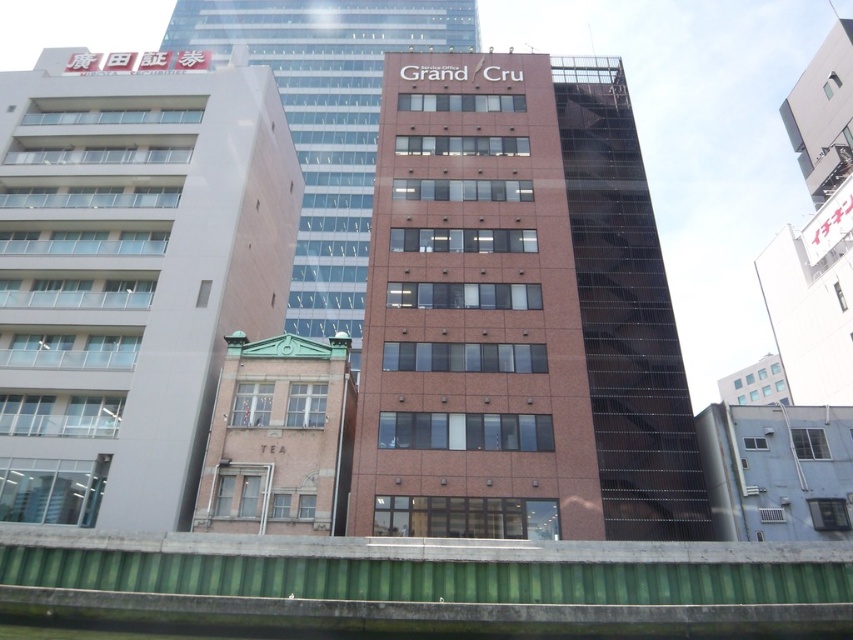
Question: Does matte brick building at left appear over blue metallic air conditioning unit at lower right?

Choices:
 (A) yes
 (B) no

Answer: (A)

Question: Is green concrete wall at lower center wider than brown brick building at lower left?

Choices:
 (A) yes
 (B) no

Answer: (A)

Question: Can you confirm if matte brick building at left is positioned above green concrete wall at lower center?

Choices:
 (A) no
 (B) yes

Answer: (B)

Question: Which of the following is the closest to the observer?

Choices:
 (A) brick building at center
 (B) brown brick building at center
 (C) brown brick building at lower left
 (D) green concrete wall at lower center

Answer: (D)

Question: Which object is the farthest from the brown brick building at center?

Choices:
 (A) matte brick building at left
 (B) brick building at center
 (C) brown brick building at lower left

Answer: (B)

Question: Which point is closer to the camera?

Choices:
 (A) brown brick building at lower left
 (B) blue metallic air conditioning unit at lower right
 (C) brick building at center
 (D) matte brick building at left

Answer: (A)